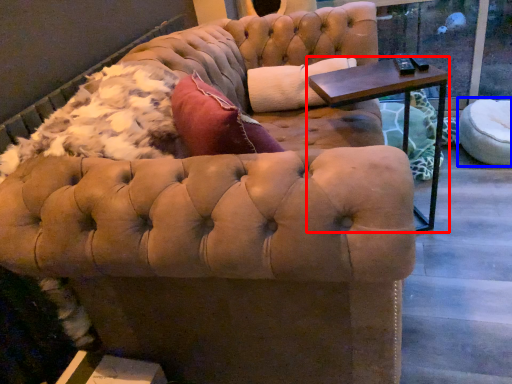
Question: Among these objects, which one is farthest to the camera, table (highlighted by a red box) or swivel chair (highlighted by a blue box)?

Choices:
 (A) table
 (B) swivel chair

Answer: (B)